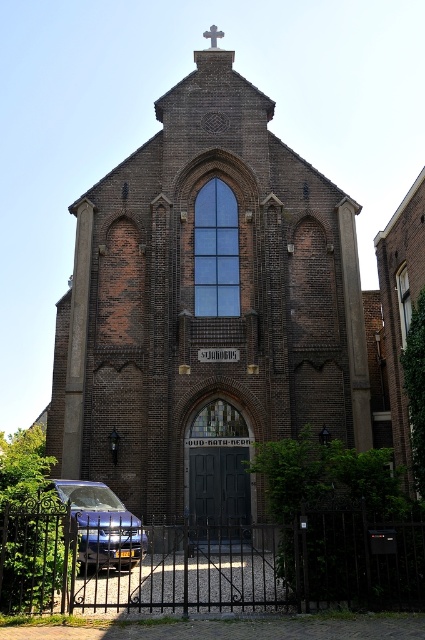
Question: Is satin blue car at lower left above white stone cross at upper center?

Choices:
 (A) no
 (B) yes

Answer: (A)

Question: In this image, where is satin blue car at lower left located relative to white stone cross at upper center?

Choices:
 (A) above
 (B) below

Answer: (B)

Question: Which object appears closest to the camera in this image?

Choices:
 (A) brown brick chapel at center
 (B) satin blue car at lower left
 (C) white stone cross at upper center

Answer: (B)

Question: Can you confirm if satin blue car at lower left is positioned to the right of white stone cross at upper center?

Choices:
 (A) no
 (B) yes

Answer: (A)

Question: Which point is closer to the camera?

Choices:
 (A) (275, 349)
 (B) (110, 538)

Answer: (B)

Question: Which of the following is the closest to the observer?

Choices:
 (A) (212, 24)
 (B) (122, 532)
 (C) (221, 456)

Answer: (B)